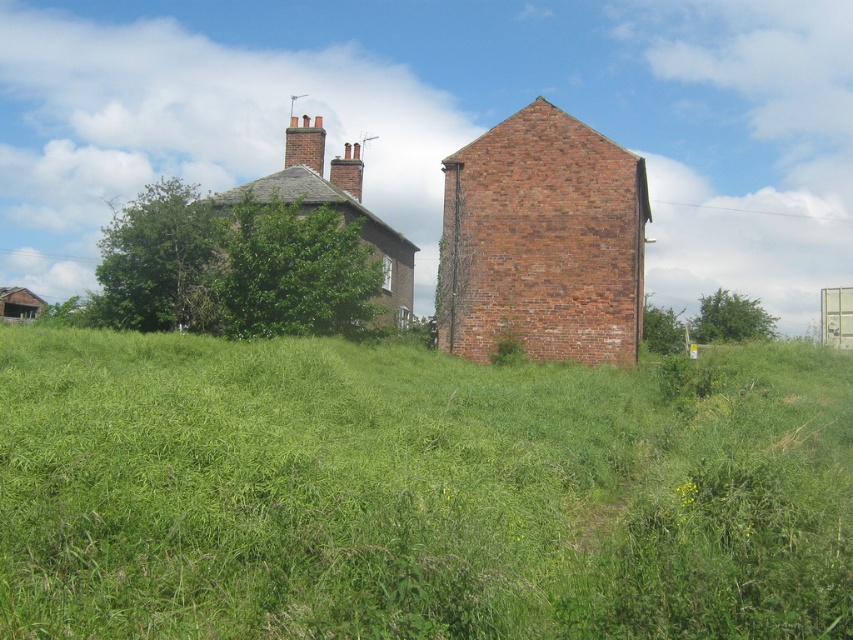
Does green grass at center have a greater width compared to red brick chimney at center?

Indeed, green grass at center has a greater width compared to red brick chimney at center.

This screenshot has height=640, width=853. Describe the element at coordinates (416, 492) in the screenshot. I see `green grass at center` at that location.

Describe the element at coordinates (416, 492) in the screenshot. I see `green grass at center` at that location.

The image size is (853, 640). I want to click on green grass at center, so click(x=416, y=492).

Who is higher up, red brick chimney at upper center or red brick chimney at center?

red brick chimney at upper center is above.

Does red brick chimney at upper center have a lesser height compared to red brick chimney at center?

Correct, red brick chimney at upper center is not as tall as red brick chimney at center.

Between point (306, 122) and point (340, 179), which one is positioned in front?

Point (306, 122)

I want to click on red brick chimney at upper center, so click(x=305, y=144).

Can you confirm if green grass at center is smaller than red brick chimney at upper center?

Incorrect, green grass at center is not smaller in size than red brick chimney at upper center.

Does green grass at center appear on the right side of red brick chimney at upper center?

Correct, you'll find green grass at center to the right of red brick chimney at upper center.

The image size is (853, 640). Identify the location of green grass at center. (416, 492).